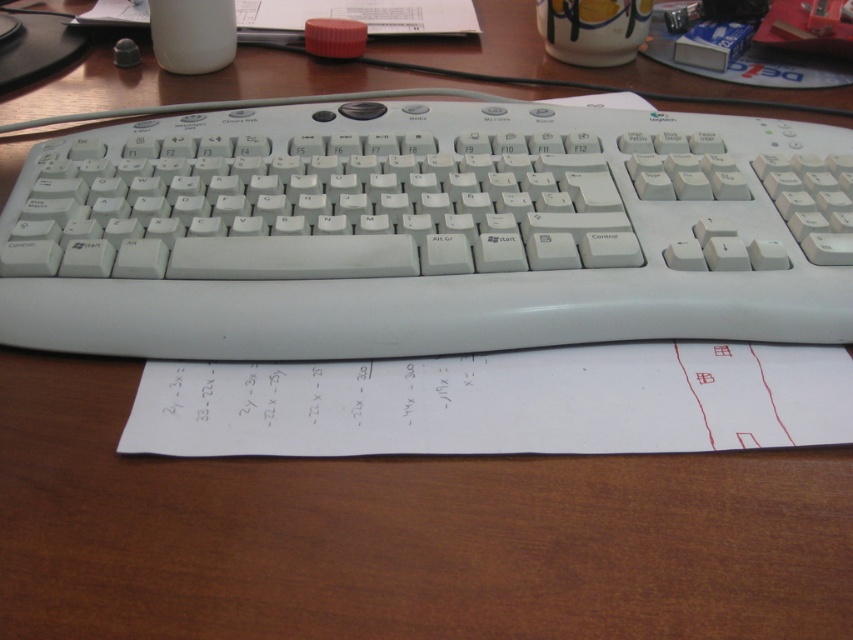
Does white plastic keyboard at center have a smaller size compared to white paper at lower center?

Actually, white plastic keyboard at center might be larger than white paper at lower center.

Is point (613, 289) behind point (184, 445)?

That is True.

Who is more distant from viewer, (312, 250) or (434, 392)?

Point (312, 250)

What are the coordinates of `white plastic keyboard at center` in the screenshot? It's located at (426, 232).